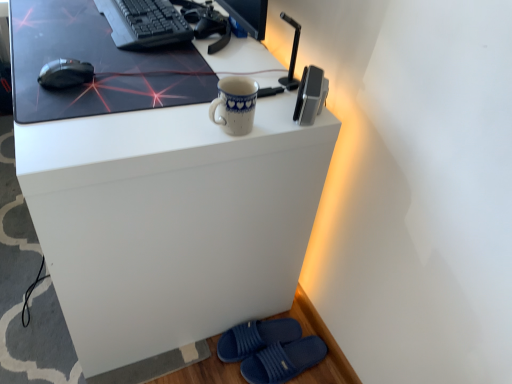
Question: Is blue rubber slippers at lower right, marked as the second footwear in a top-to-bottom arrangement, at the right side of black matte keyboard at upper left?

Choices:
 (A) no
 (B) yes

Answer: (B)

Question: Does blue rubber slippers at lower right, which is the 1th footwear in bottom-to-top order, appear on the left side of black matte keyboard at upper left?

Choices:
 (A) yes
 (B) no

Answer: (B)

Question: Is blue rubber slippers at lower right, which is the 1th footwear in bottom-to-top order, looking in the opposite direction of black matte keyboard at upper left?

Choices:
 (A) yes
 (B) no

Answer: (B)

Question: Can you see blue rubber slippers at lower right, marked as the second footwear in a top-to-bottom arrangement, touching black matte keyboard at upper left?

Choices:
 (A) no
 (B) yes

Answer: (A)

Question: From the image's perspective, is blue rubber slippers at lower right, which is the 1th footwear in bottom-to-top order, on black matte keyboard at upper left?

Choices:
 (A) no
 (B) yes

Answer: (A)

Question: Considering the positions of white glossy desk at center and blue fabric slippers at lower right, which ranks as the second footwear in bottom-to-top order, in the image, is white glossy desk at center bigger or smaller than blue fabric slippers at lower right, which ranks as the second footwear in bottom-to-top order,?

Choices:
 (A) big
 (B) small

Answer: (A)

Question: Is white glossy desk at center to the left or to the right of blue fabric slippers at lower right, which ranks as the 1th footwear in top-to-bottom order, in the image?

Choices:
 (A) right
 (B) left

Answer: (B)

Question: Is point (80, 254) positioned closer to the camera than point (259, 344)?

Choices:
 (A) farther
 (B) closer

Answer: (B)

Question: Considering the positions of white glossy desk at center and blue fabric slippers at lower right, which ranks as the second footwear in bottom-to-top order, in the image, is white glossy desk at center taller or shorter than blue fabric slippers at lower right, which ranks as the second footwear in bottom-to-top order,?

Choices:
 (A) tall
 (B) short

Answer: (A)

Question: Considering the positions of blue porcelain mug at upper center and matte black mousepad at upper center in the image, is blue porcelain mug at upper center taller or shorter than matte black mousepad at upper center?

Choices:
 (A) tall
 (B) short

Answer: (A)

Question: Relative to matte black mousepad at upper center, is blue porcelain mug at upper center in front or behind?

Choices:
 (A) front
 (B) behind

Answer: (A)

Question: From a real-world perspective, is blue porcelain mug at upper center above or below matte black mousepad at upper center?

Choices:
 (A) below
 (B) above

Answer: (B)

Question: Is blue porcelain mug at upper center spatially inside matte black mousepad at upper center, or outside of it?

Choices:
 (A) inside
 (B) outside

Answer: (B)

Question: Choose the correct answer: Is blue fabric slippers at lower right, which ranks as the 1th footwear in top-to-bottom order, inside blue porcelain mug at upper center or outside it?

Choices:
 (A) outside
 (B) inside

Answer: (A)

Question: Does point (231, 331) appear closer or farther from the camera than point (211, 112)?

Choices:
 (A) closer
 (B) farther

Answer: (B)